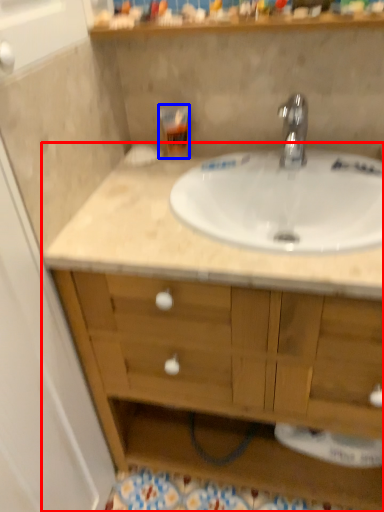
Question: Which point is further to the camera, bathroom cabinet (highlighted by a red box) or toiletry (highlighted by a blue box)?

Choices:
 (A) bathroom cabinet
 (B) toiletry

Answer: (B)